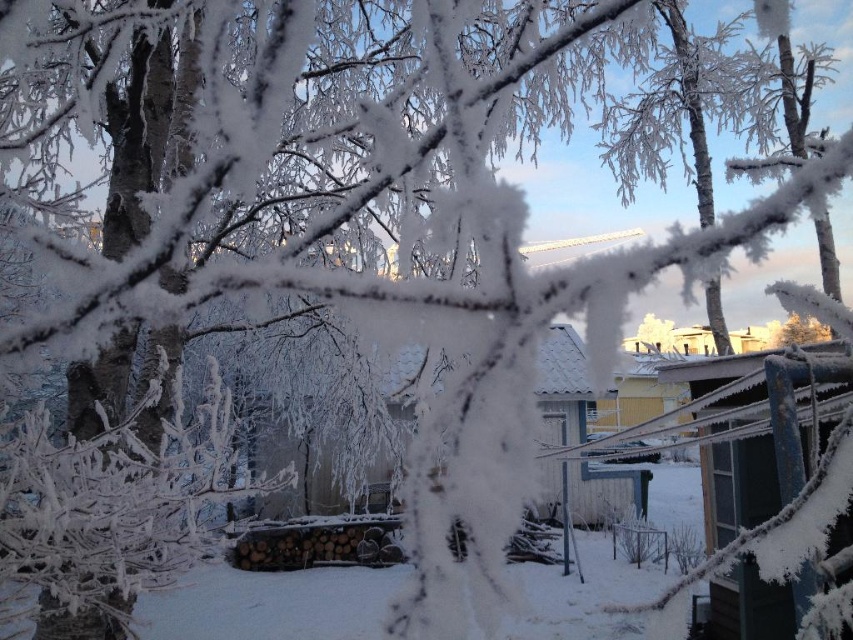
Question: Can you confirm if blue painted wood hut at right is positioned to the right of white wooden hut at center?

Choices:
 (A) yes
 (B) no

Answer: (A)

Question: Does blue painted wood hut at right come in front of white wooden hut at center?

Choices:
 (A) no
 (B) yes

Answer: (A)

Question: Is blue painted wood hut at right below white wooden hut at center?

Choices:
 (A) no
 (B) yes

Answer: (A)

Question: Which object is closer to the camera taking this photo?

Choices:
 (A) white wooden hut at center
 (B) blue painted wood hut at right

Answer: (A)